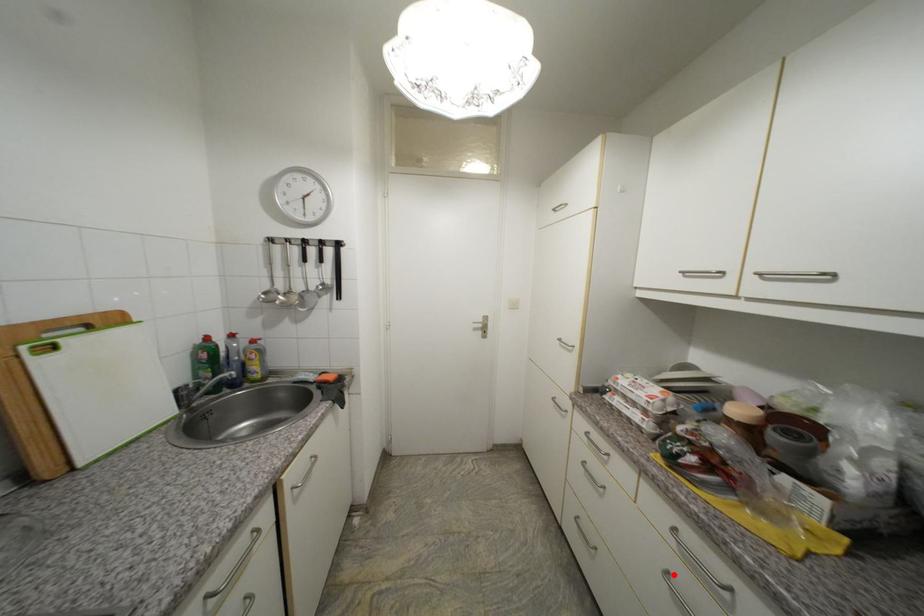
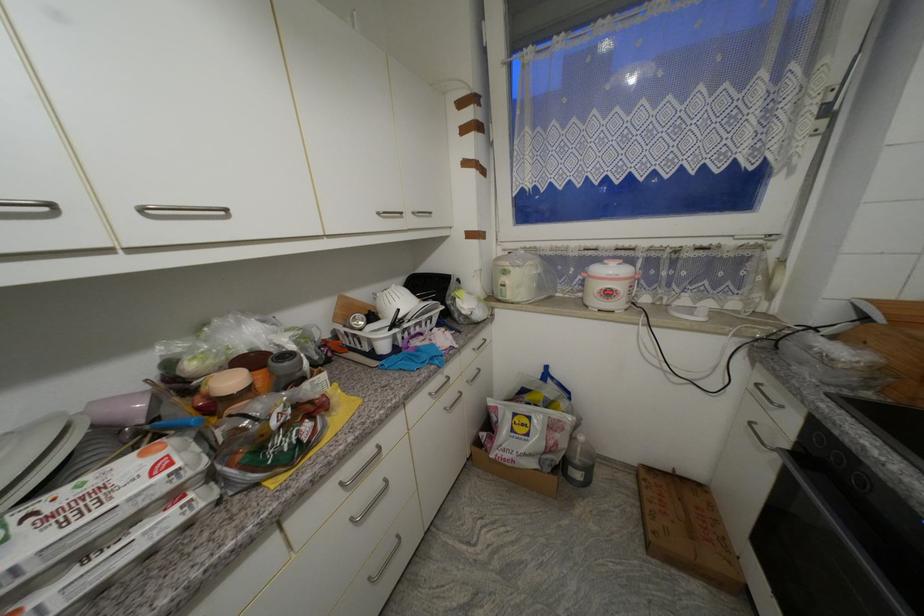
In the second image, find the point that corresponds to the highlighted location in the first image.

(358, 521)